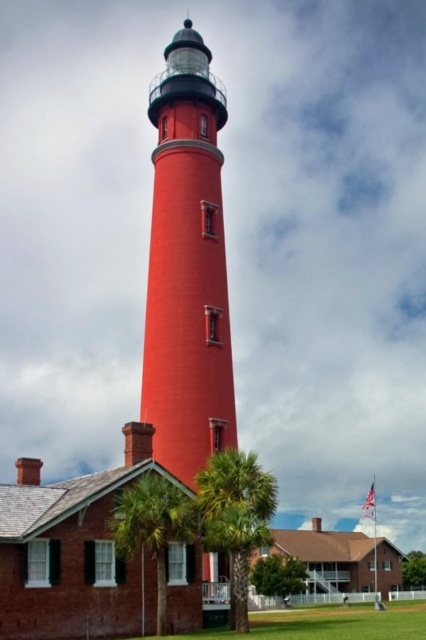
Is green leafy palm tree at lower center smaller than green leafy palm tree at center?

Actually, green leafy palm tree at lower center might be larger than green leafy palm tree at center.

Is green leafy palm tree at lower center shorter than green leafy palm tree at center?

In fact, green leafy palm tree at lower center may be taller than green leafy palm tree at center.

You are a GUI agent. You are given a task and a screenshot of the screen. Output one action in this format:
    pyautogui.click(x=<x>, y=<y>)
    Task: Click on the green leafy palm tree at lower center
    
    Given the screenshot: What is the action you would take?
    pyautogui.click(x=236, y=516)

Can you confirm if matte red lighthouse at center is smaller than green leafy palm tree at center?

No.

The height and width of the screenshot is (640, 426). What do you see at coordinates (187, 268) in the screenshot?
I see `matte red lighthouse at center` at bounding box center [187, 268].

Locate an element on the screen. This screenshot has width=426, height=640. matte red lighthouse at center is located at coordinates (187, 268).

What do you see at coordinates (187, 268) in the screenshot? I see `matte red lighthouse at center` at bounding box center [187, 268].

Is point (149, 276) positioned behind point (236, 595)?

Yes, point (149, 276) is behind point (236, 595).

The width and height of the screenshot is (426, 640). I want to click on matte red lighthouse at center, so click(187, 268).